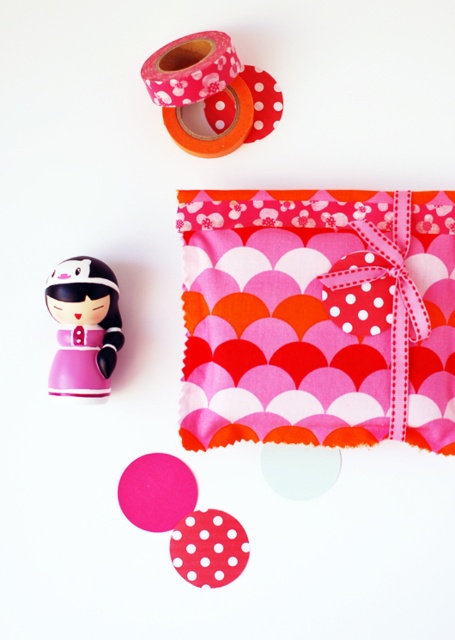
Is pink matte doll at upper left wider than pink felt circle at lower left?

No, pink matte doll at upper left is not wider than pink felt circle at lower left.

Measure the distance from pink matte doll at upper left to pink felt circle at lower left.

8.58 inches

Is point (110, 307) positioned before point (121, 493)?

That is True.

Identify the location of pink matte doll at upper left. tap(84, 326).

Who is more forward, (247, 294) or (165, 468)?

Point (247, 294) is in front.

Can you confirm if pink scalloped fabric at upper center is shorter than pink felt circle at lower left?

No.

Which is behind, point (390, 228) or point (146, 486)?

The point (146, 486) is behind.

Locate an element on the screen. pink scalloped fabric at upper center is located at coordinates (318, 317).

Who is more distant from viewer, (158,56) or (86,340)?

Point (86,340)

Who is positioned more to the right, pink matte washi tape at upper center or pink matte doll at upper left?

From the viewer's perspective, pink matte washi tape at upper center appears more on the right side.

Between point (252, 136) and point (111, 300), which one is positioned behind?

The point (252, 136) is more distant.

You are a GUI agent. You are given a task and a screenshot of the screen. Output one action in this format:
    pyautogui.click(x=<x>, y=<y>)
    Task: Click on the pink matte washi tape at upper center
    The height and width of the screenshot is (640, 455).
    Given the screenshot: What is the action you would take?
    pyautogui.click(x=211, y=92)